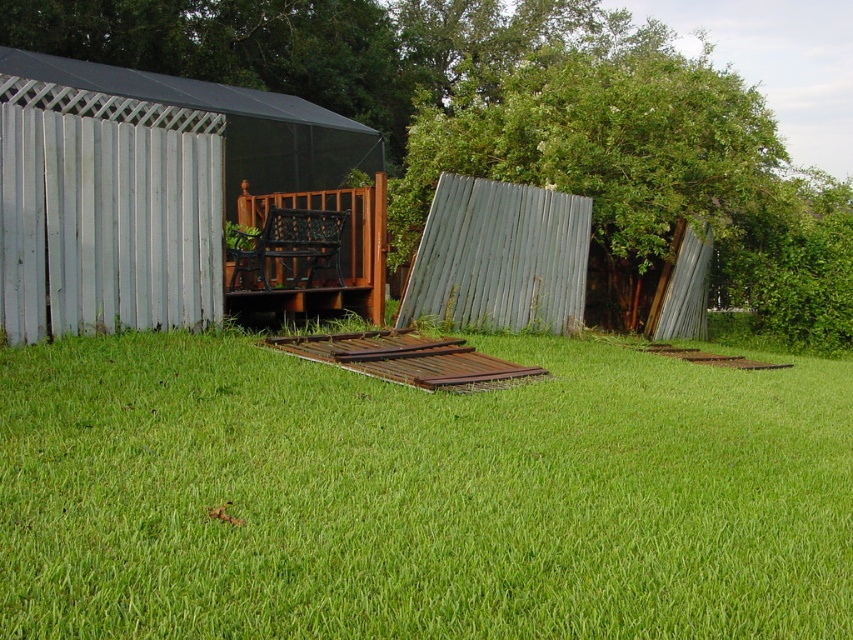
You are standing in the backyard and want to place a small potted plant on the closest surface to you between the green grass at center and the green corrugated metal at upper right. Which surface should you choose?

The green grass at center is closer to the viewer than the green corrugated metal at upper right, so you should choose the green grass at center as the surface to place the potted plant.

You are standing in the backyard and want to place a 10 meter long fence between the metallic corrugated hut at left and the green corrugated metal at upper right. Will the fence fit between them?

The distance between the metallic corrugated hut at left and the green corrugated metal at upper right is 8.79 meters. Since the fence is 10 meters long, it will not fit between them as the distance is shorter than the fence length.